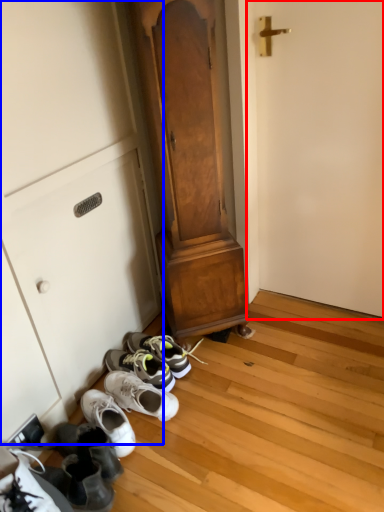
Question: Which point is closer to the camera, door (highlighted by a red box) or cabinetry (highlighted by a blue box)?

Choices:
 (A) door
 (B) cabinetry

Answer: (A)